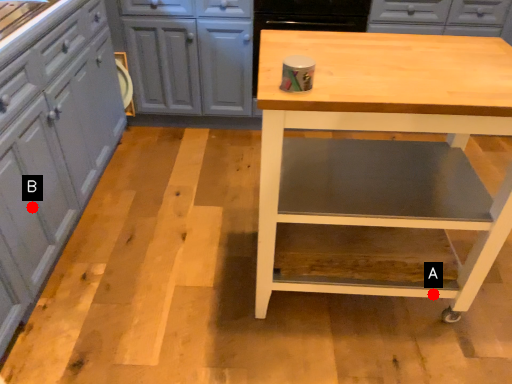
Question: Two points are circled on the image, labeled by A and B beside each circle. Which point appears farthest from the camera in this image?

Choices:
 (A) A is further
 (B) B is further

Answer: (A)